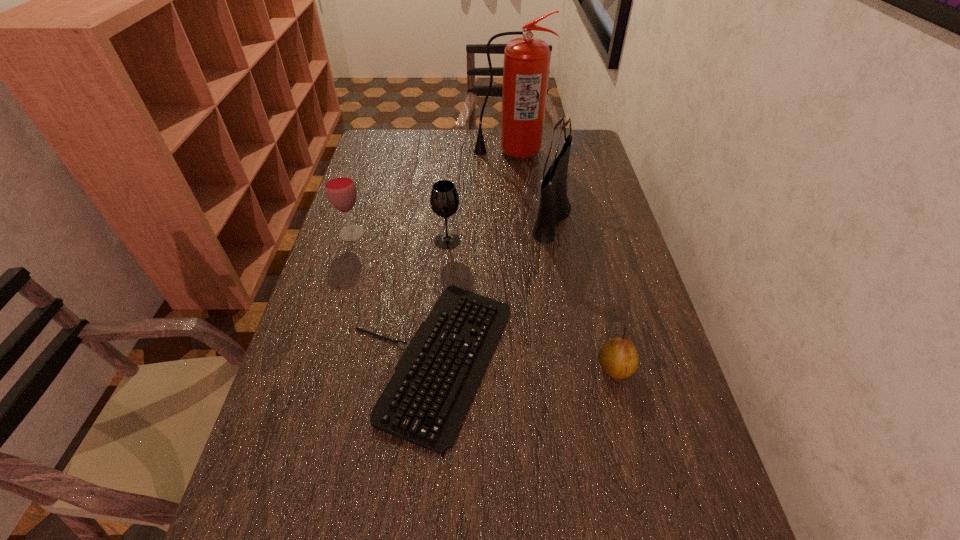
At what (x,y) coordinates should I click in order to perform the action: click on free location located on the back of the leftmost object. Please return your answer as a coordinate pair (x, y). Looking at the image, I should click on (364, 196).

Find the location of a particular element. This screenshot has height=540, width=960. vacant space located on the left of the second shortest object is located at coordinates (501, 368).

Find the location of `blank space located on the back of the shortest object`. blank space located on the back of the shortest object is located at coordinates (440, 262).

Find the location of `object that is at the far edge`. object that is at the far edge is located at coordinates (526, 65).

I want to click on wineglass that is at the left edge, so click(340, 189).

Where is `computer keyboard at the left edge`? The height and width of the screenshot is (540, 960). computer keyboard at the left edge is located at coordinates (425, 402).

Where is `shoulder bag that is positioned at the right edge`? The width and height of the screenshot is (960, 540). shoulder bag that is positioned at the right edge is located at coordinates (554, 207).

Image resolution: width=960 pixels, height=540 pixels. Identify the location of pear positioned at the right edge. (618, 357).

At what (x,y) coordinates should I click in order to perform the action: click on free region at the far edge of the desktop. Please return your answer as a coordinate pair (x, y). Looking at the image, I should click on (457, 137).

This screenshot has width=960, height=540. In order to click on vacant space at the left edge of the desktop in this screenshot , I will do `click(342, 438)`.